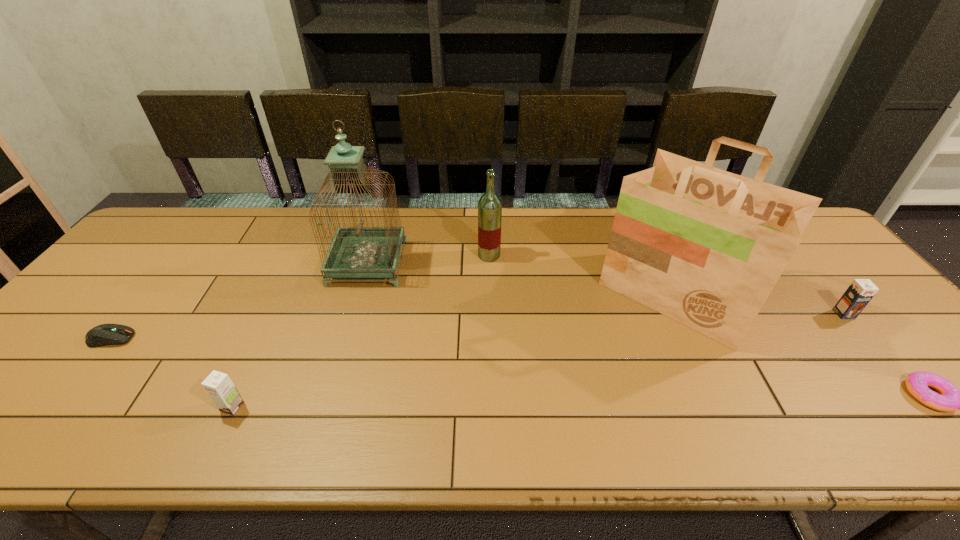
The height and width of the screenshot is (540, 960). Identify the location of free space at the far edge. (x=446, y=222).

Find the location of a particular element. blank space at the near edge of the desktop is located at coordinates (914, 430).

In the image, there is a desktop. Identify the location of vacant space at the far left corner. This screenshot has height=540, width=960. [x=172, y=208].

Identify the location of vacant space that is in between the computer equipment and the grocery bag. (394, 317).

The image size is (960, 540). In order to click on free spot between the liquor and the left chocolate milk in this screenshot , I will do `click(361, 331)`.

What are the coordinates of `vacant space that is in between the third object from left to right and the right chocolate milk` in the screenshot? It's located at tap(606, 288).

At what (x,y) coordinates should I click in order to perform the action: click on free point between the leftmost object and the left chocolate milk. Please return your answer as a coordinate pair (x, y). This screenshot has height=540, width=960. Looking at the image, I should click on (172, 373).

At what (x,y) coordinates should I click in order to perform the action: click on vacant area that lies between the third object from left to right and the right chocolate milk. Please return your answer as a coordinate pair (x, y). Image resolution: width=960 pixels, height=540 pixels. Looking at the image, I should click on pyautogui.click(x=606, y=288).

At what (x,y) coordinates should I click in order to perform the action: click on empty space between the third object from left to right and the fifth object from left to right. Please return your answer as a coordinate pair (x, y). Image resolution: width=960 pixels, height=540 pixels. Looking at the image, I should click on (522, 279).

Locate an element on the screen. free space between the nearer chocolate milk and the fourth object from left to right is located at coordinates (361, 331).